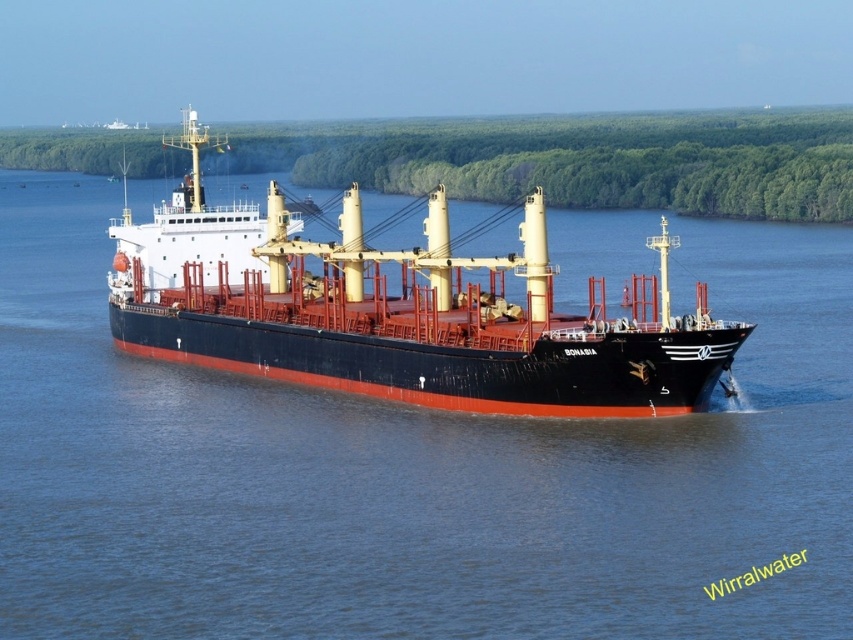
Question: Which point is closer to the camera?

Choices:
 (A) (532, 189)
 (B) (297, 477)

Answer: (B)

Question: Which object appears closest to the camera in this image?

Choices:
 (A) blue water at center
 (B) black matte cargo ship at center

Answer: (A)

Question: Which point is farther to the camera?

Choices:
 (A) black matte cargo ship at center
 (B) blue water at center

Answer: (A)

Question: Can you confirm if blue water at center is positioned below black matte cargo ship at center?

Choices:
 (A) no
 (B) yes

Answer: (B)

Question: Does blue water at center have a greater width compared to black matte cargo ship at center?

Choices:
 (A) no
 (B) yes

Answer: (B)

Question: Is blue water at center wider than black matte cargo ship at center?

Choices:
 (A) yes
 (B) no

Answer: (A)